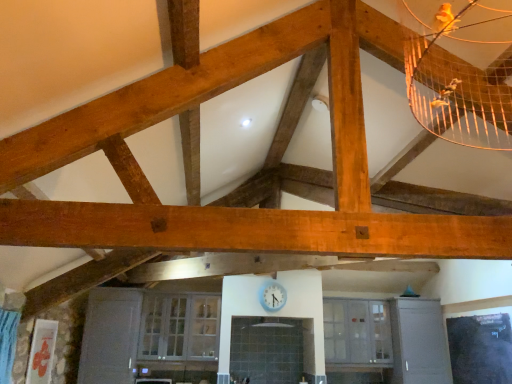
Question: Does clear glass cabinet at center, marked as the second window in a left-to-right arrangement, have a larger size compared to clear glass cabinet at lower center, the 2th window when ordered from right to left?

Choices:
 (A) no
 (B) yes

Answer: (A)

Question: Considering the relative sizes of clear glass cabinet at center, which ranks as the first window in right-to-left order, and clear glass cabinet at lower center, which is the first window in left-to-right order, in the image provided, is clear glass cabinet at center, which ranks as the first window in right-to-left order, taller than clear glass cabinet at lower center, which is the first window in left-to-right order,?

Choices:
 (A) no
 (B) yes

Answer: (A)

Question: Is clear glass cabinet at lower center, which is the first window in left-to-right order, at the back of clear glass cabinet at center, which ranks as the first window in right-to-left order?

Choices:
 (A) yes
 (B) no

Answer: (B)

Question: Is clear glass cabinet at center, marked as the second window in a left-to-right arrangement, not within clear glass cabinet at lower center, which is the first window in left-to-right order?

Choices:
 (A) no
 (B) yes

Answer: (B)

Question: Considering the relative positions of clear glass cabinet at center, which ranks as the first window in right-to-left order, and clear glass cabinet at lower center, which is the first window in left-to-right order, in the image provided, is clear glass cabinet at center, which ranks as the first window in right-to-left order, in front of clear glass cabinet at lower center, which is the first window in left-to-right order,?

Choices:
 (A) no
 (B) yes

Answer: (A)

Question: Considering the positions of point (358, 306) and point (179, 350), is point (358, 306) closer or farther from the camera than point (179, 350)?

Choices:
 (A) farther
 (B) closer

Answer: (A)

Question: Is clear glass cabinet at center, which ranks as the first window in right-to-left order, situated inside clear glass cabinet at lower center, which is the first window in left-to-right order, or outside?

Choices:
 (A) outside
 (B) inside

Answer: (A)

Question: Considering the positions of clear glass cabinet at center, marked as the second window in a left-to-right arrangement, and clear glass cabinet at lower center, which is the first window in left-to-right order, in the image, is clear glass cabinet at center, marked as the second window in a left-to-right arrangement, wider or thinner than clear glass cabinet at lower center, which is the first window in left-to-right order,?

Choices:
 (A) wide
 (B) thin

Answer: (B)

Question: From a real-world perspective, is clear glass cabinet at center, which ranks as the first window in right-to-left order, above or below clear glass cabinet at lower center, which is the first window in left-to-right order?

Choices:
 (A) below
 (B) above

Answer: (B)

Question: Would you say clear glass cabinet at center, which ranks as the first window in right-to-left order, is inside or outside blue glossy clock at center?

Choices:
 (A) outside
 (B) inside

Answer: (A)

Question: Considering the positions of clear glass cabinet at center, which ranks as the first window in right-to-left order, and blue glossy clock at center in the image, is clear glass cabinet at center, which ranks as the first window in right-to-left order, bigger or smaller than blue glossy clock at center?

Choices:
 (A) small
 (B) big

Answer: (B)

Question: In the image, is clear glass cabinet at center, marked as the second window in a left-to-right arrangement, on the left side or the right side of blue glossy clock at center?

Choices:
 (A) right
 (B) left

Answer: (A)

Question: Is clear glass cabinet at center, which ranks as the first window in right-to-left order, wider or thinner than blue glossy clock at center?

Choices:
 (A) wide
 (B) thin

Answer: (A)

Question: Looking at their shapes, would you say blue glossy clock at center is wider or thinner than clear glass cabinet at center, marked as the second window in a left-to-right arrangement?

Choices:
 (A) thin
 (B) wide

Answer: (A)

Question: Relative to clear glass cabinet at center, which ranks as the first window in right-to-left order, is blue glossy clock at center in front or behind?

Choices:
 (A) behind
 (B) front

Answer: (B)